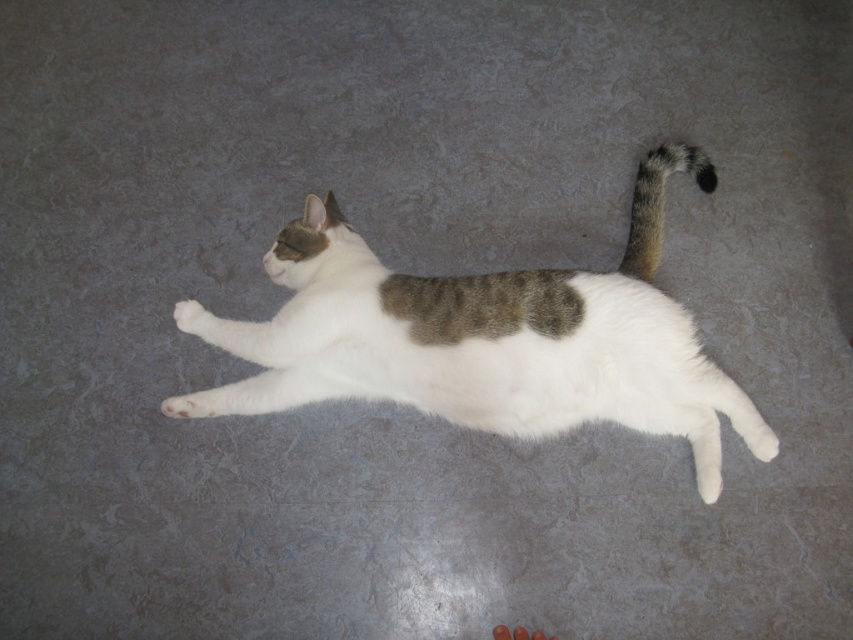
A photographer wants to capture the cat in the image. They need to focus precisely on the white fur paw at center to ensure sharpness. Given that the camera can only focus on objects within a 0.1 unit radius around the point specified, will the focus be successful?

The white fur paw at center is positioned at point (190, 317). Since the camera focuses within a 0.1 unit radius around the specified point, the focus will be successful as the paw is precisely at the center point within the required radius.

You are a photographer trying to capture the white fur cat at center and the striped fur tail at upper right in a single frame. Based on their positions, can you tell which one is closer to the camera?

The white fur cat at center is closer to the camera because it is in front of the striped fur tail at upper right.

You are a photographer trying to capture the white fur cat at center and the white fur paw at center in a single frame. Which object should you focus on first if you want to ensure both are in focus, considering their sizes?

The white fur cat at center is wider than the white fur paw at center, so focusing on the larger object first will help ensure both are in focus.